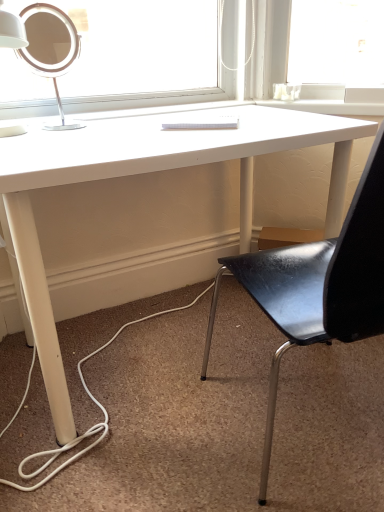
Question: Relative to black leather chair at center, is white matte desk at center in front or behind?

Choices:
 (A) behind
 (B) front

Answer: (A)

Question: From the image's perspective, relative to black leather chair at center, is white matte desk at center above or below?

Choices:
 (A) above
 (B) below

Answer: (A)

Question: Based on their relative distances, which object is nearer to the white matte desk at center?

Choices:
 (A) black leather chair at center
 (B) matte white lamp at upper left

Answer: (B)

Question: Which of these objects is positioned closest to the matte white lamp at upper left?

Choices:
 (A) white matte desk at center
 (B) black leather chair at center

Answer: (A)